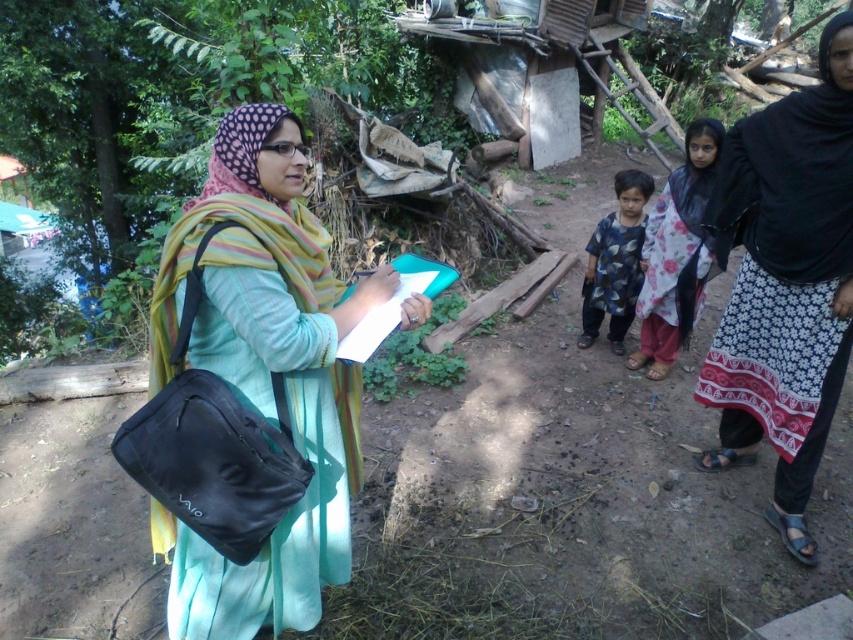
Can you confirm if black printed skirt at lower right is positioned below floral fabric hijab at center?

Yes, black printed skirt at lower right is below floral fabric hijab at center.

Which is in front, point (706, 358) or point (698, 230)?

Positioned in front is point (706, 358).

At what (x,y) coordinates should I click in order to perform the action: click on black printed skirt at lower right. Please return your answer as a coordinate pair (x, y). This screenshot has width=853, height=640. Looking at the image, I should click on (785, 284).

Between point (688, 148) and point (635, 234), which one is positioned behind?

The point (635, 234) is behind.

Is floral fabric hijab at center smaller than blue printed shirt at center?

Actually, floral fabric hijab at center might be larger than blue printed shirt at center.

Describe the element at coordinates (676, 253) in the screenshot. I see `floral fabric hijab at center` at that location.

I want to click on floral fabric hijab at center, so click(676, 253).

Who is more forward, (819, 426) or (646, 189)?

Point (819, 426)

Does black printed skirt at lower right lie in front of blue printed shirt at center?

Yes, it is in front of blue printed shirt at center.

What do you see at coordinates (785, 284) in the screenshot?
I see `black printed skirt at lower right` at bounding box center [785, 284].

You are a GUI agent. You are given a task and a screenshot of the screen. Output one action in this format:
    pyautogui.click(x=<x>, y=<y>)
    Task: Click on the black printed skirt at lower right
    Image resolution: width=853 pixels, height=640 pixels.
    Given the screenshot: What is the action you would take?
    pyautogui.click(x=785, y=284)